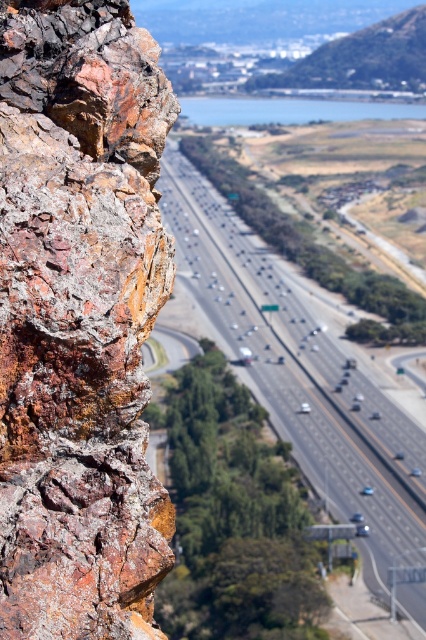
Question: Can you confirm if rusty rock at left is positioned to the left of smooth asphalt highway at center?

Choices:
 (A) no
 (B) yes

Answer: (B)

Question: Considering the real-world distances, which object is farthest from the smooth asphalt highway at center?

Choices:
 (A) green grassy hill at upper right
 (B) rusty rock at left

Answer: (B)

Question: Where is smooth asphalt highway at center located in relation to green grassy hill at upper right in the image?

Choices:
 (A) below
 (B) above

Answer: (A)

Question: Which point is farther to the camera?

Choices:
 (A) rusty rock at left
 (B) green grassy hill at upper right

Answer: (B)

Question: Which object is positioned closest to the smooth asphalt highway at center?

Choices:
 (A) rusty rock at left
 (B) green grassy hill at upper right

Answer: (B)

Question: Is smooth asphalt highway at center further to the viewer compared to green grassy hill at upper right?

Choices:
 (A) yes
 (B) no

Answer: (B)